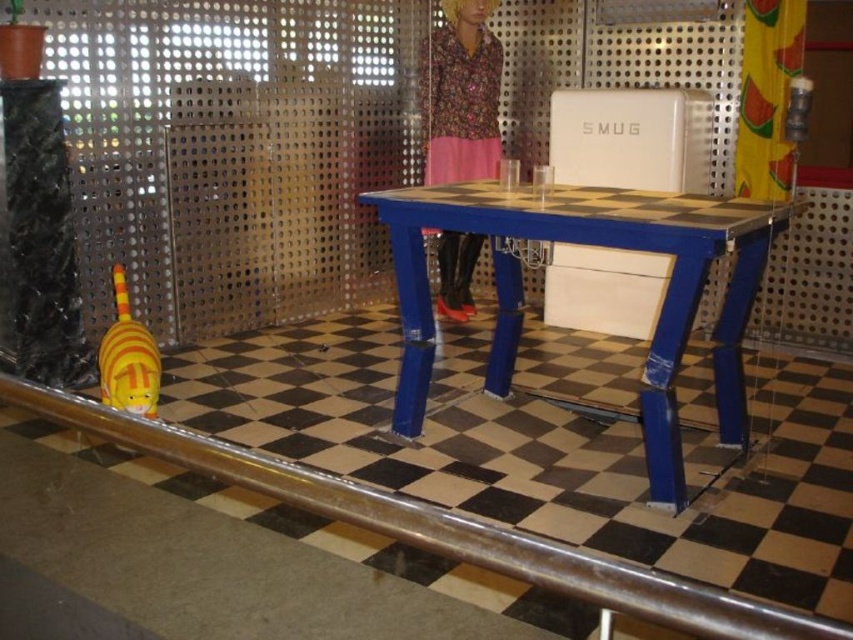
Question: Estimate the real-world distances between objects in this image. Which object is closer to the floral fabric doll at center?

Choices:
 (A) blue painted wood table at center
 (B) black fabric at left

Answer: (A)

Question: In this image, where is blue painted wood table at center located relative to yellow striped plush at lower left?

Choices:
 (A) below
 (B) above

Answer: (B)

Question: Estimate the real-world distances between objects in this image. Which object is farther from the black fabric at left?

Choices:
 (A) yellow striped plush at lower left
 (B) blue painted wood table at center

Answer: (B)

Question: Which of the following is the farthest from the observer?

Choices:
 (A) blue painted wood table at center
 (B) black fabric at left

Answer: (B)

Question: Does black fabric at left lie in front of floral fabric doll at center?

Choices:
 (A) yes
 (B) no

Answer: (A)

Question: Does floral fabric doll at center appear on the right side of yellow striped plush at lower left?

Choices:
 (A) no
 (B) yes

Answer: (B)